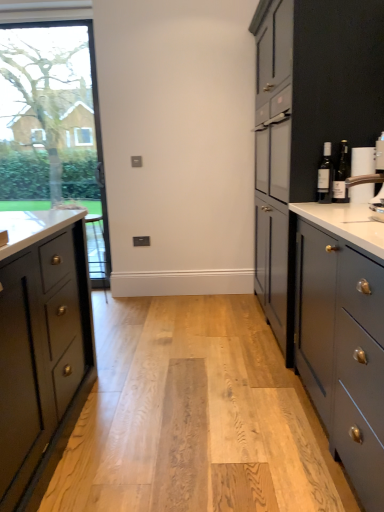
This screenshot has height=512, width=384. I want to click on matte gray cabinets at right, so click(x=334, y=83).

What do you see at coordinates (334, 83) in the screenshot?
I see `matte gray cabinets at right` at bounding box center [334, 83].

Locate an element on the screen. This screenshot has width=384, height=512. matte glass bottle at right, which is counted as the second bottle, starting from the left is located at coordinates (341, 175).

Image resolution: width=384 pixels, height=512 pixels. What are the coordinates of `clear glass window at left` in the screenshot? It's located at (53, 127).

Looking at the image, does matte gray cabinets at right seem bigger or smaller compared to matte glass bottle at right, the 1th bottle viewed from the right?

matte gray cabinets at right is bigger than matte glass bottle at right, the 1th bottle viewed from the right.

Are matte gray cabinets at right and matte glass bottle at right, the 1th bottle viewed from the right, located far from each other?

No.

From the picture: From the image's perspective, who appears lower, matte glass bottle at right, which is counted as the 2th bottle, starting from the right, or matte glass bottle at right, which is counted as the second bottle, starting from the left?

matte glass bottle at right, which is counted as the second bottle, starting from the left.

This screenshot has height=512, width=384. I want to click on bottle above the matte glass bottle at right, which is counted as the second bottle, starting from the left (from the image's perspective), so coord(325,176).

From their relative heights in the image, would you say matte glass bottle at right, acting as the first bottle starting from the left, is taller or shorter than matte glass bottle at right, which is counted as the second bottle, starting from the left?

In the image, matte glass bottle at right, acting as the first bottle starting from the left, appears to be shorter than matte glass bottle at right, which is counted as the second bottle, starting from the left.

Is matte glass bottle at right, the 1th bottle viewed from the right, located within matte glass bottle at right, acting as the first bottle starting from the left?

No.

Between white glossy coffee machine at upper right and matte glass bottle at right, acting as the first bottle starting from the left, which one has less height?

With less height is white glossy coffee machine at upper right.

From the image's perspective, between white glossy coffee machine at upper right and matte glass bottle at right, acting as the first bottle starting from the left, which one is located above?

matte glass bottle at right, acting as the first bottle starting from the left, appears higher in the image.

Between white glossy coffee machine at upper right and matte glass bottle at right, which is counted as the 2th bottle, starting from the right, which one appears on the left side from the viewer's perspective?

From the viewer's perspective, white glossy coffee machine at upper right appears more on the left side.

Does white glossy coffee machine at upper right turn towards matte glass bottle at right, acting as the first bottle starting from the left?

No.

Is matte glass bottle at right, the 1th bottle viewed from the right, taller than matte gray cabinets at right?

No, matte glass bottle at right, the 1th bottle viewed from the right, is not taller than matte gray cabinets at right.

How many degrees apart are the facing directions of matte glass bottle at right, the 1th bottle viewed from the right, and matte gray cabinets at right?

67 degrees.

Is matte glass bottle at right, the 1th bottle viewed from the right, at the left side of matte gray cabinets at right?

Indeed, matte glass bottle at right, the 1th bottle viewed from the right, is positioned on the left side of matte gray cabinets at right.

Is matte glass bottle at right, the 1th bottle viewed from the right, wider or thinner than matte gray cabinets at right?

Considering their sizes, matte glass bottle at right, the 1th bottle viewed from the right, looks slimmer than matte gray cabinets at right.

How distant is clear glass window at left from matte gray cabinets at right?

clear glass window at left and matte gray cabinets at right are 3.08 meters apart from each other.

Is clear glass window at left bigger than matte gray cabinets at right?

No, clear glass window at left is not bigger than matte gray cabinets at right.

Is clear glass window at left facing towards matte gray cabinets at right?

No.

Based on their sizes in the image, would you say matte glass bottle at right, the 1th bottle viewed from the right, is bigger or smaller than matte glass bottle at right, acting as the first bottle starting from the left?

Clearly, matte glass bottle at right, the 1th bottle viewed from the right, is smaller in size than matte glass bottle at right, acting as the first bottle starting from the left.

Considering the sizes of objects matte glass bottle at right, which is counted as the second bottle, starting from the left, and matte glass bottle at right, which is counted as the 2th bottle, starting from the right, in the image provided, who is taller, matte glass bottle at right, which is counted as the second bottle, starting from the left, or matte glass bottle at right, which is counted as the 2th bottle, starting from the right,?

matte glass bottle at right, which is counted as the second bottle, starting from the left.

From a real-world perspective, which object stands above the other?

matte glass bottle at right, acting as the first bottle starting from the left, is physically above.

Based on their positions, is white glossy coffee machine at upper right located to the left or right of matte gray cabinets at right?

In the image, white glossy coffee machine at upper right appears on the left side of matte gray cabinets at right.

From the image's perspective, would you say white glossy coffee machine at upper right is shown under matte gray cabinets at right?

Yes, from the image's perspective, white glossy coffee machine at upper right is below matte gray cabinets at right.

Can you tell me how much white glossy coffee machine at upper right and matte gray cabinets at right differ in facing direction?

white glossy coffee machine at upper right and matte gray cabinets at right are facing 7.01 degrees away from each other.

Does white glossy coffee machine at upper right have a smaller size compared to matte gray cabinets at right?

Yes, white glossy coffee machine at upper right is smaller than matte gray cabinets at right.

Locate an element on the screen. The height and width of the screenshot is (512, 384). cabinetry on the right of matte glass bottle at right, the 1th bottle viewed from the right is located at coordinates (334, 83).

Locate an element on the screen. bottle on the left of the matte glass bottle at right, which is counted as the second bottle, starting from the left is located at coordinates (325, 176).

Which object lies nearer to the anchor point matte glass bottle at right, acting as the first bottle starting from the left, matte glass bottle at right, which is counted as the second bottle, starting from the left, or clear glass window at left?

Among the two, matte glass bottle at right, which is counted as the second bottle, starting from the left, is located nearer to matte glass bottle at right, acting as the first bottle starting from the left.

From the image, which object appears to be nearer to matte glass bottle at right, which is counted as the second bottle, starting from the left, white glossy coffee machine at upper right or clear glass window at left?

white glossy coffee machine at upper right is positioned closer to the anchor matte glass bottle at right, which is counted as the second bottle, starting from the left.

Based on their spatial positions, is white glossy coffee machine at upper right or matte glass bottle at right, the 1th bottle viewed from the right, further from matte glass bottle at right, acting as the first bottle starting from the left?

white glossy coffee machine at upper right.

Estimate the real-world distances between objects in this image. Which object is further from matte glass bottle at right, which is counted as the second bottle, starting from the left, clear glass window at left or white glossy coffee machine at upper right?

Based on the image, clear glass window at left appears to be further to matte glass bottle at right, which is counted as the second bottle, starting from the left.

Which object lies further to the anchor point matte gray cabinets at right, matte glass bottle at right, which is counted as the 2th bottle, starting from the right, or clear glass window at left?

clear glass window at left is further to matte gray cabinets at right.

Based on the photo, considering their positions, is matte glass bottle at right, the 1th bottle viewed from the right, positioned closer to clear glass window at left than white glossy coffee machine at upper right?

Based on the image, matte glass bottle at right, the 1th bottle viewed from the right, appears to be nearer to clear glass window at left.

Considering their positions, is matte gray cabinets at right positioned closer to clear glass window at left than white glossy coffee machine at upper right?

matte gray cabinets at right lies closer to clear glass window at left than the other object.

From the image, which object appears to be nearer to matte glass bottle at right, the 1th bottle viewed from the right, matte glass bottle at right, which is counted as the 2th bottle, starting from the right, or clear glass window at left?

matte glass bottle at right, which is counted as the 2th bottle, starting from the right, is closer to matte glass bottle at right, the 1th bottle viewed from the right.

Where is `bottle located between matte gray cabinets at right and matte glass bottle at right, acting as the first bottle starting from the left, in the depth direction`? This screenshot has height=512, width=384. bottle located between matte gray cabinets at right and matte glass bottle at right, acting as the first bottle starting from the left, in the depth direction is located at coordinates (341, 175).

In order to click on cabinetry located between white glossy coffee machine at upper right and matte glass bottle at right, acting as the first bottle starting from the left, in the depth direction in this screenshot , I will do `click(334, 83)`.

This screenshot has height=512, width=384. I want to click on coffee machine between clear glass window at left and matte glass bottle at right, which is counted as the second bottle, starting from the left, in the horizontal direction, so click(373, 181).

This screenshot has width=384, height=512. I want to click on cabinetry between white glossy coffee machine at upper right and matte glass bottle at right, which is counted as the second bottle, starting from the left, along the z-axis, so click(x=334, y=83).